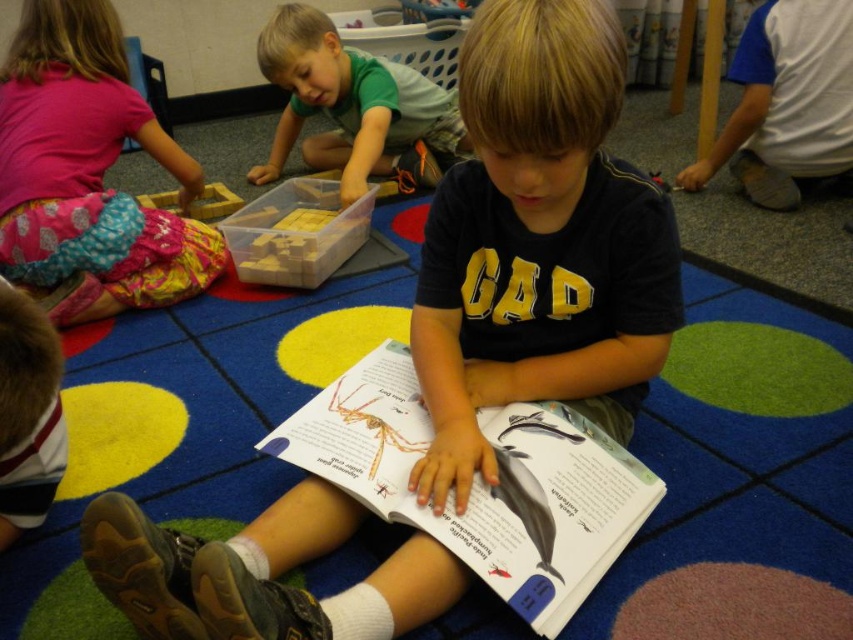
Between matte pink shirt at upper left and white cotton shirt at lower right, which one is positioned lower?

matte pink shirt at upper left is lower down.

Which is more to the left, matte pink shirt at upper left or white cotton shirt at lower right?

matte pink shirt at upper left is more to the left.

Is point (96, 58) positioned in front of point (758, 176)?

Yes.

The width and height of the screenshot is (853, 640). I want to click on matte pink shirt at upper left, so click(x=88, y=173).

Is matte black shirt at center bigger than white paper book at center?

Yes, matte black shirt at center is bigger than white paper book at center.

Where is `matte black shirt at center`? matte black shirt at center is located at coordinates (538, 243).

Does point (270, 582) come in front of point (833, 152)?

Yes, point (270, 582) is closer to viewer.

Which is more to the left, matte black shirt at center or white cotton shirt at lower right?

matte black shirt at center is more to the left.

Identify the location of matte black shirt at center. This screenshot has width=853, height=640. (538, 243).

You are a GUI agent. You are given a task and a screenshot of the screen. Output one action in this format:
    pyautogui.click(x=<x>, y=<y>)
    Task: Click on the matte black shirt at center
    The height and width of the screenshot is (640, 853).
    Given the screenshot: What is the action you would take?
    pyautogui.click(x=538, y=243)